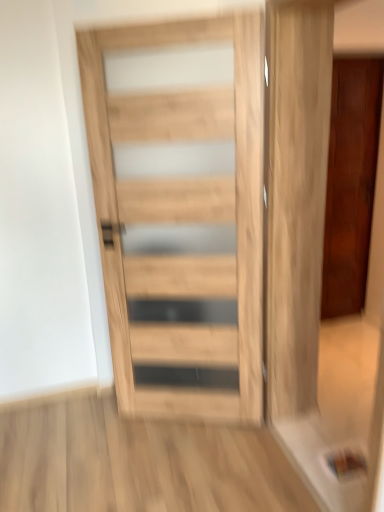
Image resolution: width=384 pixels, height=512 pixels. What do you see at coordinates (182, 218) in the screenshot?
I see `natural wood door at center, which ranks as the second door in back-to-front order` at bounding box center [182, 218].

The image size is (384, 512). I want to click on natural wood door at center, which ranks as the second door in back-to-front order, so click(x=182, y=218).

What do you see at coordinates (350, 182) in the screenshot?
I see `shiny dark wood door at right, arranged as the second door when viewed from the left` at bounding box center [350, 182].

This screenshot has width=384, height=512. In order to click on shiny dark wood door at right, which ranks as the first door in back-to-front order in this screenshot , I will do `click(350, 182)`.

Image resolution: width=384 pixels, height=512 pixels. Find the location of `natural wood door at center, the 1th door from the front`. natural wood door at center, the 1th door from the front is located at coordinates (182, 218).

Based on their positions, is natural wood door at center, arranged as the 2th door when viewed from the right, located to the left or right of shiny dark wood door at right, arranged as the second door when viewed from the front?

Based on their positions, natural wood door at center, arranged as the 2th door when viewed from the right, is located to the left of shiny dark wood door at right, arranged as the second door when viewed from the front.

Considering their positions, is natural wood door at center, which ranks as the second door in back-to-front order, located in front of or behind shiny dark wood door at right, which is counted as the first door, starting from the right?

In the image, natural wood door at center, which ranks as the second door in back-to-front order, appears in front of shiny dark wood door at right, which is counted as the first door, starting from the right.

Considering the points (154, 293) and (357, 165), which point is in front, point (154, 293) or point (357, 165)?

The point (154, 293) is in front.

From the image's perspective, is natural wood door at center, the first door in the left-to-right sequence, above or below shiny dark wood door at right, which is counted as the first door, starting from the right?

natural wood door at center, the first door in the left-to-right sequence, is below shiny dark wood door at right, which is counted as the first door, starting from the right.

From a real-world perspective, is natural wood door at center, which ranks as the second door in back-to-front order, on shiny dark wood door at right, which is counted as the first door, starting from the right?

Yes.

Does natural wood door at center, which ranks as the second door in back-to-front order, have a lesser width compared to shiny dark wood door at right, which ranks as the first door in back-to-front order?

Indeed, natural wood door at center, which ranks as the second door in back-to-front order, has a lesser width compared to shiny dark wood door at right, which ranks as the first door in back-to-front order.

Is natural wood door at center, the 1th door from the front, shorter than shiny dark wood door at right, which is counted as the first door, starting from the right?

Yes.

Considering the relative sizes of natural wood door at center, the 1th door from the front, and shiny dark wood door at right, arranged as the second door when viewed from the front, in the image provided, is natural wood door at center, the 1th door from the front, smaller than shiny dark wood door at right, arranged as the second door when viewed from the front,?

Indeed, natural wood door at center, the 1th door from the front, has a smaller size compared to shiny dark wood door at right, arranged as the second door when viewed from the front.

Would you say natural wood door at center, arranged as the 2th door when viewed from the right, is outside shiny dark wood door at right, arranged as the second door when viewed from the front?

Indeed, natural wood door at center, arranged as the 2th door when viewed from the right, is completely outside shiny dark wood door at right, arranged as the second door when viewed from the front.

Is natural wood door at center, the 1th door from the front, next to shiny dark wood door at right, arranged as the second door when viewed from the front, and touching it?

They are not placed beside each other.

Is natural wood door at center, arranged as the 2th door when viewed from the right, aimed at shiny dark wood door at right, which is counted as the first door, starting from the right?

No, natural wood door at center, arranged as the 2th door when viewed from the right, is not aimed at shiny dark wood door at right, which is counted as the first door, starting from the right.

Find the location of `door on the left of shiny dark wood door at right, which ranks as the first door in back-to-front order`. door on the left of shiny dark wood door at right, which ranks as the first door in back-to-front order is located at coordinates (182, 218).

Based on the photo, is shiny dark wood door at right, arranged as the second door when viewed from the front, to the left of natural wood door at center, the first door in the left-to-right sequence, from the viewer's perspective?

No.

Between shiny dark wood door at right, which is counted as the first door, starting from the right, and natural wood door at center, the 1th door from the front, which one is positioned in front?

Positioned in front is natural wood door at center, the 1th door from the front.

Does point (367, 126) appear closer or farther from the camera than point (245, 378)?

Point (367, 126) appears to be farther away from the viewer than point (245, 378).

From the image's perspective, which one is positioned lower, shiny dark wood door at right, arranged as the second door when viewed from the front, or natural wood door at center, which ranks as the second door in back-to-front order?

From the image's view, natural wood door at center, which ranks as the second door in back-to-front order, is below.

From a real-world perspective, who is located higher, shiny dark wood door at right, which ranks as the first door in back-to-front order, or natural wood door at center, the first door in the left-to-right sequence?

natural wood door at center, the first door in the left-to-right sequence, is physically above.

Which object is thinner, shiny dark wood door at right, which ranks as the first door in back-to-front order, or natural wood door at center, arranged as the 2th door when viewed from the right?

Thinner between the two is natural wood door at center, arranged as the 2th door when viewed from the right.

Considering the sizes of shiny dark wood door at right, arranged as the second door when viewed from the front, and natural wood door at center, arranged as the 2th door when viewed from the right, in the image, is shiny dark wood door at right, arranged as the second door when viewed from the front, taller or shorter than natural wood door at center, arranged as the 2th door when viewed from the right,?

Clearly, shiny dark wood door at right, arranged as the second door when viewed from the front, is taller compared to natural wood door at center, arranged as the 2th door when viewed from the right.

Is shiny dark wood door at right, arranged as the second door when viewed from the front, bigger or smaller than natural wood door at center, arranged as the 2th door when viewed from the right?

In the image, shiny dark wood door at right, arranged as the second door when viewed from the front, appears to be larger than natural wood door at center, arranged as the 2th door when viewed from the right.

Can natural wood door at center, which ranks as the second door in back-to-front order, be found inside shiny dark wood door at right, which ranks as the first door in back-to-front order?

No, natural wood door at center, which ranks as the second door in back-to-front order, is not inside shiny dark wood door at right, which ranks as the first door in back-to-front order.

Would you consider shiny dark wood door at right, which is counted as the first door, starting from the right, to be distant from natural wood door at center, arranged as the 2th door when viewed from the right?

That's right, there is a large distance between shiny dark wood door at right, which is counted as the first door, starting from the right, and natural wood door at center, arranged as the 2th door when viewed from the right.

Could you tell me if shiny dark wood door at right, which ranks as the first door in back-to-front order, is facing natural wood door at center, the first door in the left-to-right sequence?

No, shiny dark wood door at right, which ranks as the first door in back-to-front order, is not aimed at natural wood door at center, the first door in the left-to-right sequence.

How many degrees apart are the facing directions of shiny dark wood door at right, arranged as the second door when viewed from the front, and natural wood door at center, the first door in the left-to-right sequence?

24.3 degrees.

You are a GUI agent. You are given a task and a screenshot of the screen. Output one action in this format:
    pyautogui.click(x=<x>, y=<y>)
    Task: Click on the door below the natural wood door at center, the 1th door from the front (from a real-world perspective)
    The height and width of the screenshot is (512, 384).
    Given the screenshot: What is the action you would take?
    point(350,182)

At what (x,y) coordinates should I click in order to perform the action: click on door above the natural wood door at center, which ranks as the second door in back-to-front order (from the image's perspective). Please return your answer as a coordinate pair (x, y). The image size is (384, 512). Looking at the image, I should click on (350, 182).

Where is `door that is on the right side of natural wood door at center, the 1th door from the front`? door that is on the right side of natural wood door at center, the 1th door from the front is located at coordinates (350, 182).